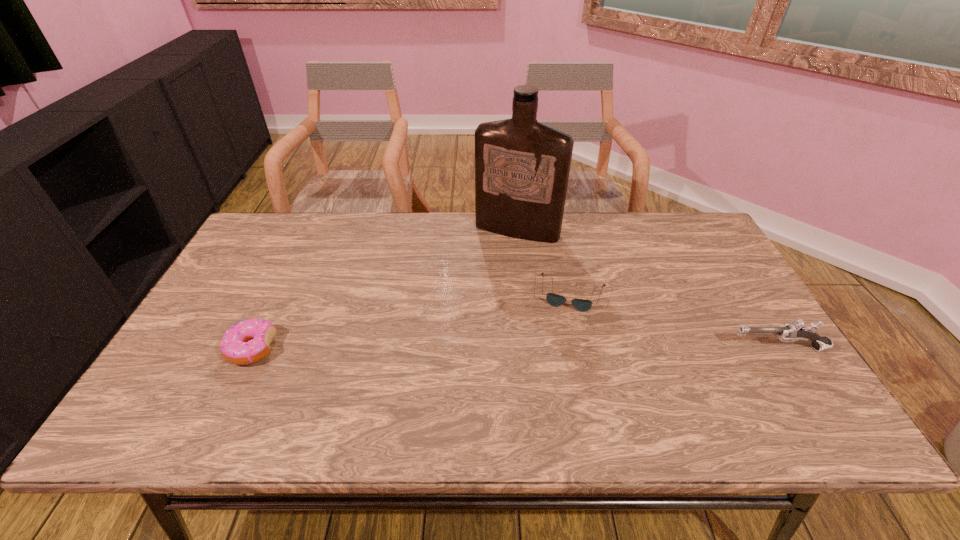
Identify the location of the second shortest object. (247, 342).

Locate an element on the screen. The width and height of the screenshot is (960, 540). doughnut is located at coordinates (247, 342).

Identify the location of the rightmost object. The image size is (960, 540). (794, 331).

This screenshot has height=540, width=960. I want to click on the third shortest object, so click(x=794, y=331).

At what (x,y) coordinates should I click in order to perform the action: click on liquor. Please return your answer as a coordinate pair (x, y). The image size is (960, 540). Looking at the image, I should click on (522, 167).

Find the location of a particular element. Image resolution: width=960 pixels, height=540 pixels. the tallest object is located at coordinates (522, 167).

This screenshot has width=960, height=540. Identify the location of sunglasses. (582, 305).

Locate an element on the screen. The width and height of the screenshot is (960, 540). the second farthest object is located at coordinates (582, 305).

What are the coordinates of `vacant region located 0.080m on the back of the leftmost object` in the screenshot? It's located at (273, 306).

This screenshot has width=960, height=540. I want to click on vacant space located aimed along the barrel of the gun, so click(x=661, y=348).